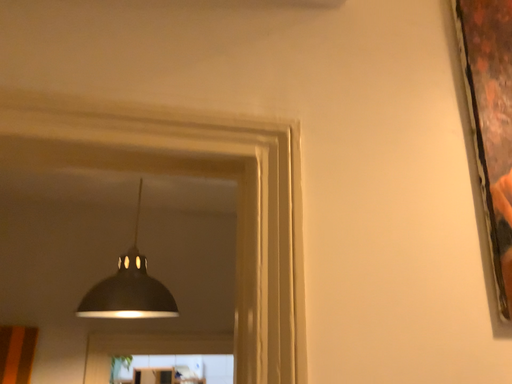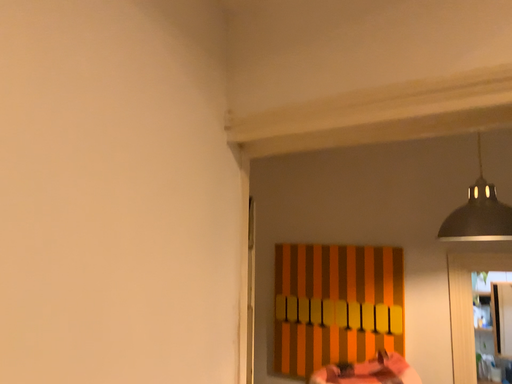
Question: Which way did the camera rotate in the video?

Choices:
 (A) rotated downward
 (B) rotated upward

Answer: (A)